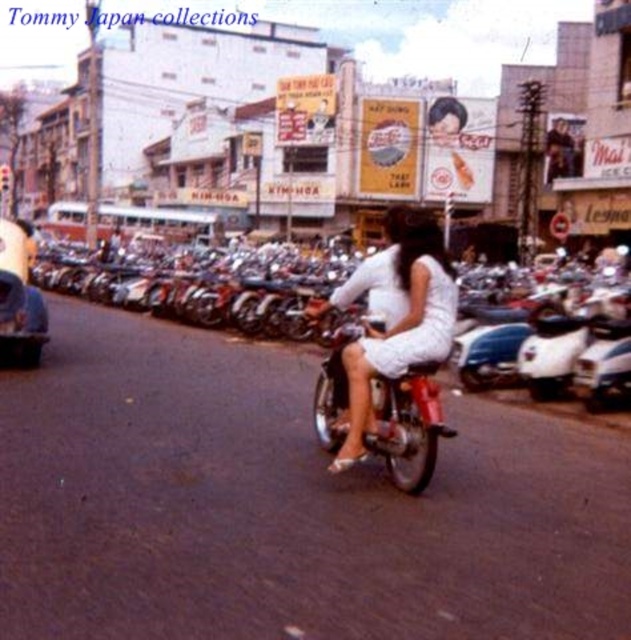
Question: Can you confirm if shiny chrome motorcycle at center is wider than metallic silver car at left?

Choices:
 (A) yes
 (B) no

Answer: (B)

Question: Among these points, which one is farthest from the camera?

Choices:
 (A) (1, 289)
 (B) (327, 429)

Answer: (A)

Question: Is the position of shiny chrome motorcycle at center more distant than that of metallic silver car at left?

Choices:
 (A) yes
 (B) no

Answer: (B)

Question: Does shiny chrome motorcycle at center appear under metallic silver car at left?

Choices:
 (A) yes
 (B) no

Answer: (A)